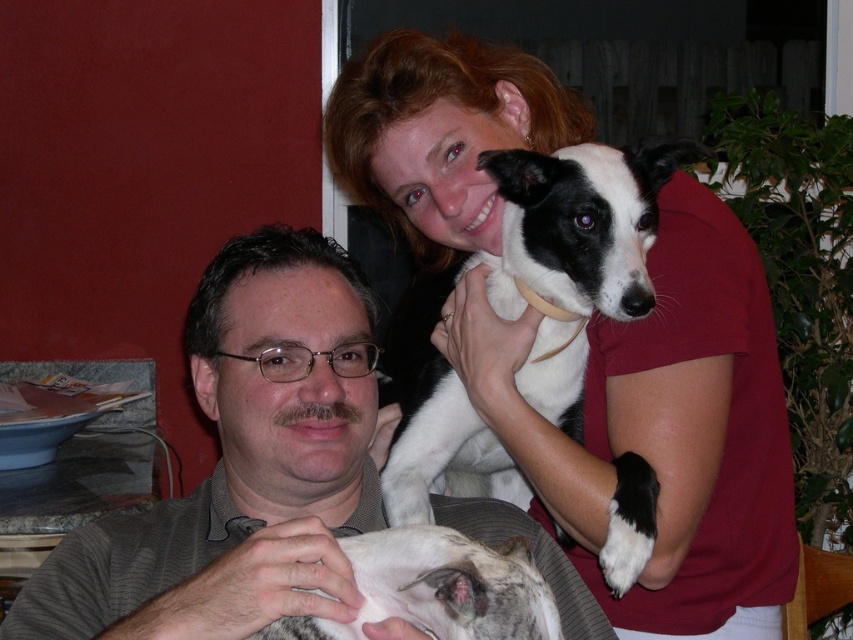
Who is lower down, gray striped shirt at center or speckled fur dog at lower center?

speckled fur dog at lower center

Is gray striped shirt at center to the left of speckled fur dog at lower center from the viewer's perspective?

Correct, you'll find gray striped shirt at center to the left of speckled fur dog at lower center.

Who is more forward, (73, 563) or (442, 588)?

Point (442, 588) is in front.

In order to click on gray striped shirt at center in this screenshot , I will do `click(241, 465)`.

From the picture: Who is lower down, gray striped shirt at center or black and white fur at upper center?

gray striped shirt at center is below.

Can you confirm if gray striped shirt at center is shorter than black and white fur at upper center?

Yes, gray striped shirt at center is shorter than black and white fur at upper center.

What do you see at coordinates (241, 465) in the screenshot? The image size is (853, 640). I see `gray striped shirt at center` at bounding box center [241, 465].

In order to click on gray striped shirt at center in this screenshot , I will do `click(241, 465)`.

Does black and white fur at upper center have a greater height compared to speckled fur dog at lower center?

Yes.

Is black and white fur at upper center above speckled fur dog at lower center?

Yes.

Who is more forward, (427, 394) or (517, 538)?

Point (517, 538)

You are a GUI agent. You are given a task and a screenshot of the screen. Output one action in this format:
    pyautogui.click(x=<x>, y=<y>)
    Task: Click on the black and white fur at upper center
    
    Given the screenshot: What is the action you would take?
    pyautogui.click(x=523, y=310)